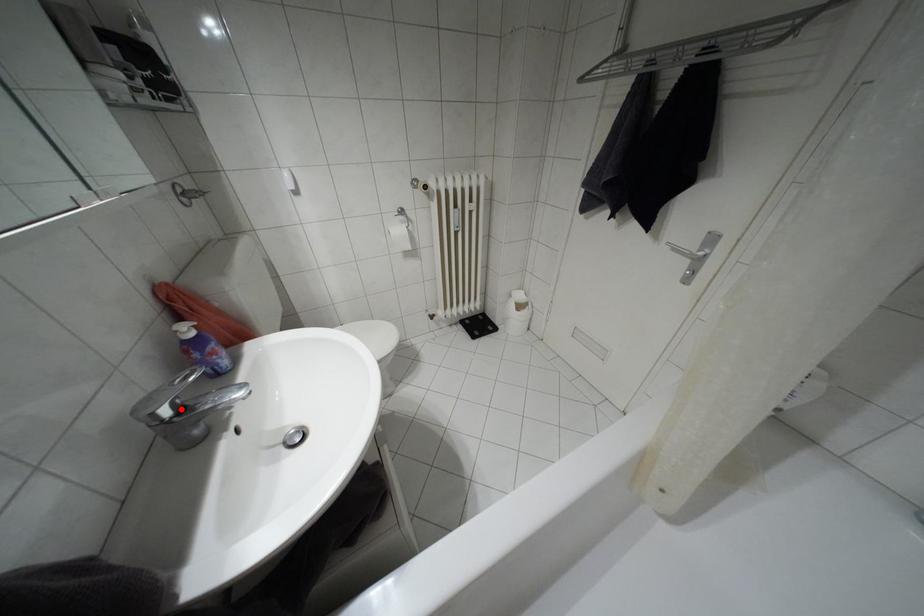
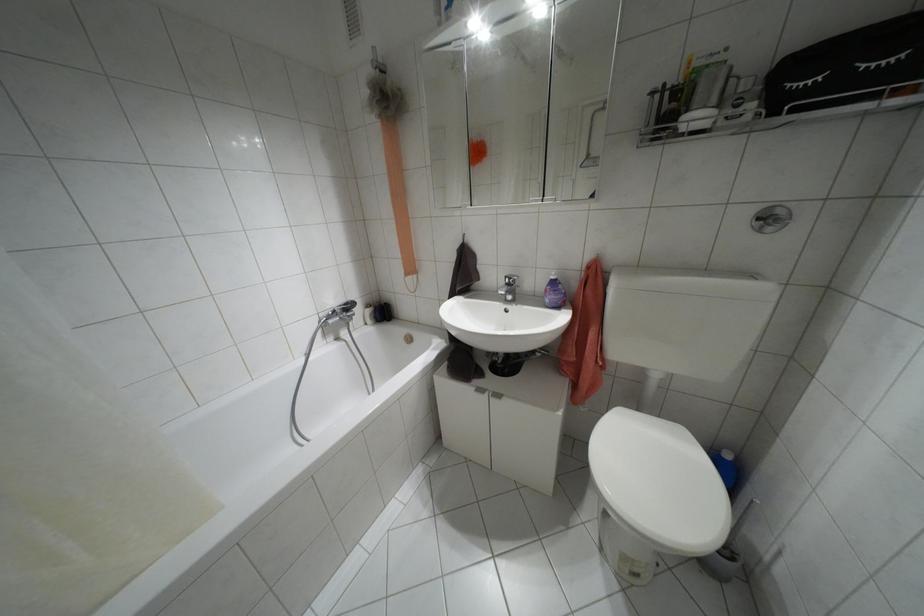
The point at the highlighted location is marked in the first image. Where is the corresponding point in the second image?

(507, 284)